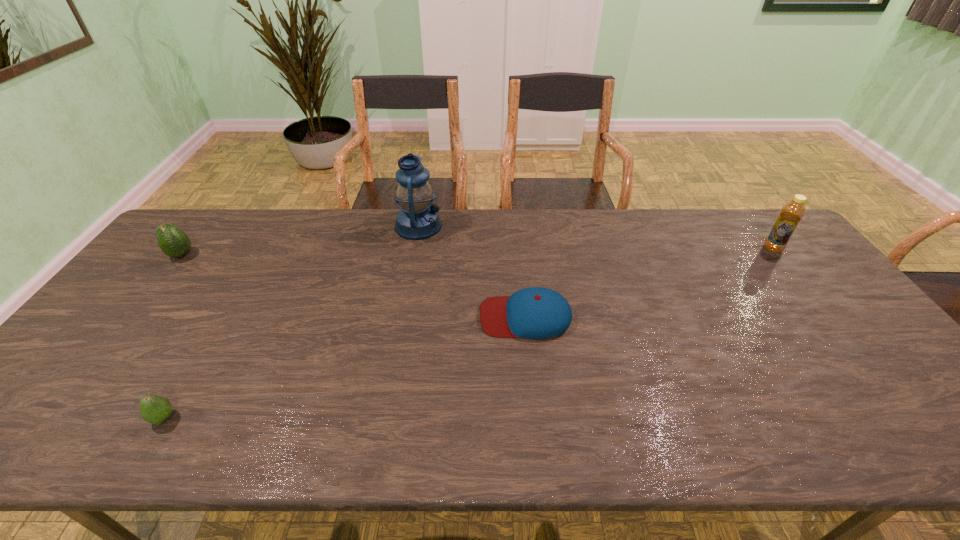
Identify the location of the tallest object. tap(418, 219).

At what (x,y) coordinates should I click in order to perform the action: click on lantern. Please return your answer as a coordinate pair (x, y). Looking at the image, I should click on (418, 219).

Identify the location of the fourth shortest object. (792, 212).

The width and height of the screenshot is (960, 540). What are the coordinates of `the rightmost object` in the screenshot? It's located at (792, 212).

Identify the location of the farther avocado. (172, 241).

Locate an element on the screen. The image size is (960, 540). the taller avocado is located at coordinates (172, 241).

Locate an element on the screen. The height and width of the screenshot is (540, 960). the nearer avocado is located at coordinates (155, 409).

In order to click on the second object from left to right in this screenshot , I will do `click(155, 409)`.

Identify the location of the second object from right to left. The width and height of the screenshot is (960, 540). (536, 312).

At what (x,y) coordinates should I click in order to perform the action: click on the second nearest object. Please return your answer as a coordinate pair (x, y). Looking at the image, I should click on (536, 312).